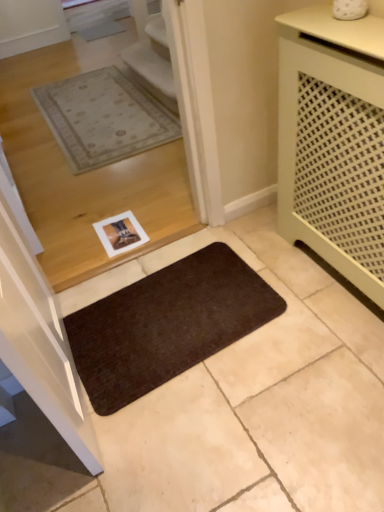
Identify the location of vacant space in matte green cabinet at right (from a real-world perspective). (328, 273).